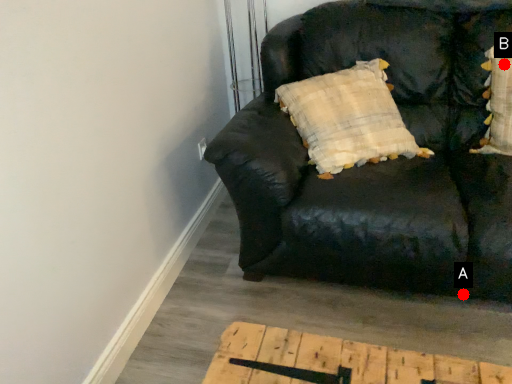
Question: Two points are circled on the image, labeled by A and B beside each circle. Which point is further to the camera?

Choices:
 (A) A is further
 (B) B is further

Answer: (B)